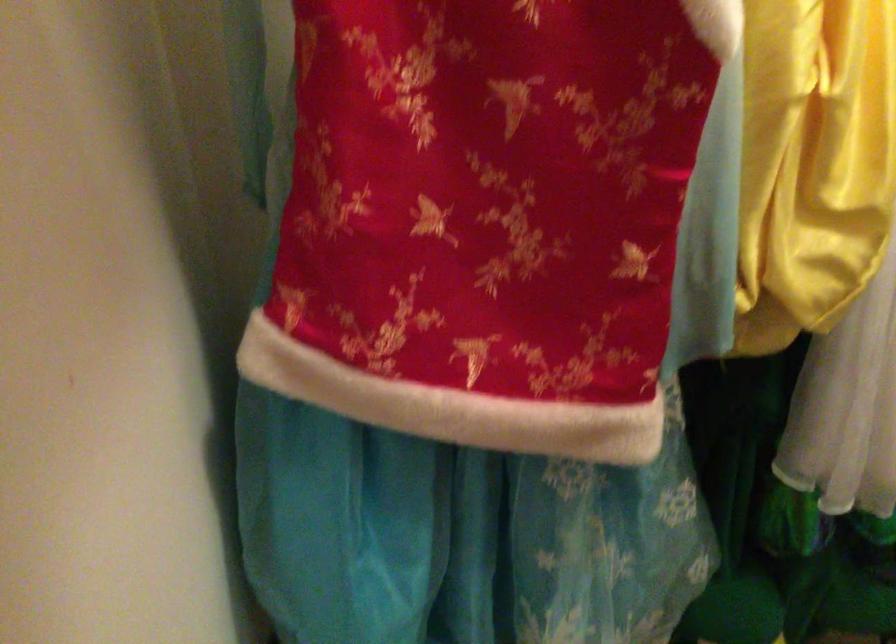
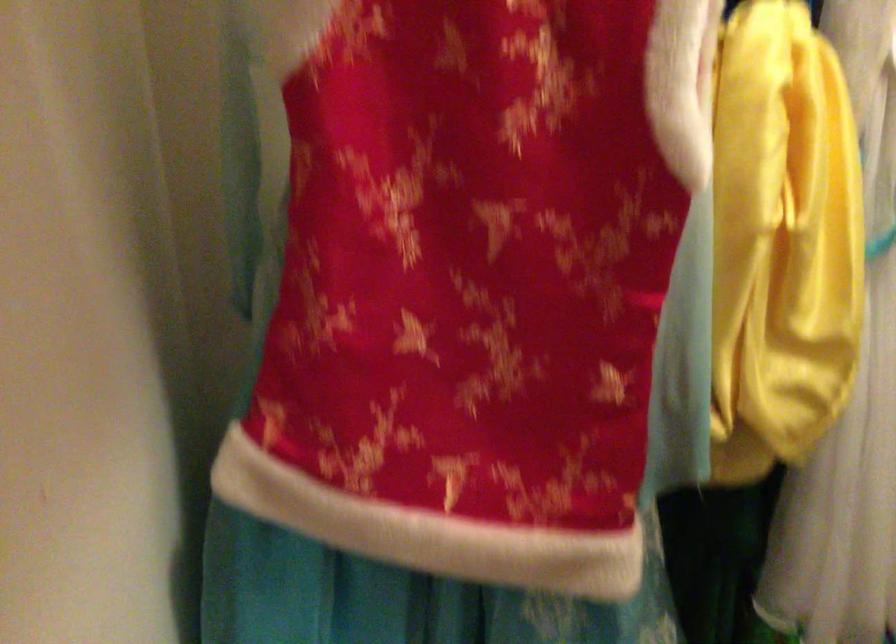
Question: The images are taken continuously from a first-person perspective. In which direction are you moving?

Choices:
 (A) Left
 (B) Right
 (C) Forward
 (D) Backward

Answer: (D)